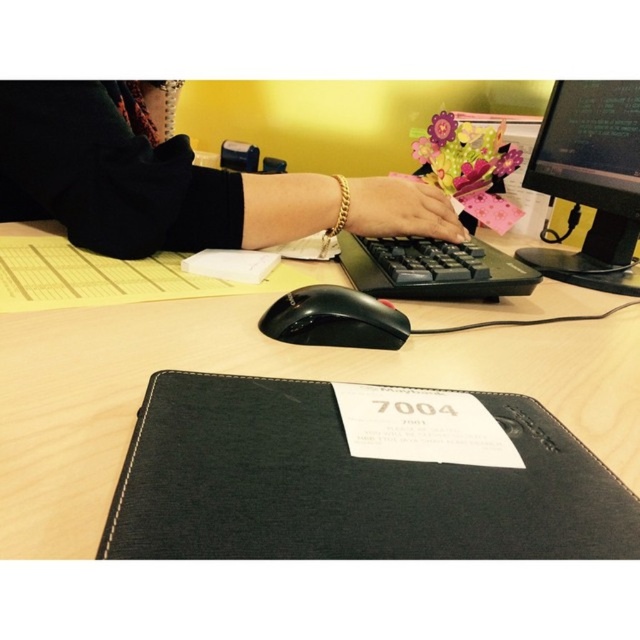
Is black leather jacket at center taller than black plastic keyboard at center?

Indeed, black leather jacket at center has a greater height compared to black plastic keyboard at center.

In the scene shown: Between black leather jacket at center and black plastic keyboard at center, which one is positioned lower?

black plastic keyboard at center is below.

Is point (68, 140) in front of point (451, 280)?

That is True.

You are a GUI agent. You are given a task and a screenshot of the screen. Output one action in this format:
    pyautogui.click(x=<x>, y=<y>)
    Task: Click on the black leather jacket at center
    
    Given the screenshot: What is the action you would take?
    pyautogui.click(x=176, y=180)

Is black leather jacket at center to the left of gold bracelet at center from the viewer's perspective?

Indeed, black leather jacket at center is positioned on the left side of gold bracelet at center.

Between point (372, 205) and point (456, 216), which one is positioned in front?

Positioned in front is point (372, 205).

Between point (104, 106) and point (349, 202), which one is positioned behind?

The point (349, 202) is behind.

This screenshot has width=640, height=640. In order to click on black leather jacket at center in this screenshot , I will do `click(176, 180)`.

Can you confirm if black plastic mouse at center is positioned to the left of gold bracelet at center?

Correct, you'll find black plastic mouse at center to the left of gold bracelet at center.

Find the location of a particular element. black plastic mouse at center is located at coordinates (333, 320).

At what (x,y) coordinates should I click in order to perform the action: click on black plastic mouse at center. Please return your answer as a coordinate pair (x, y). Image resolution: width=640 pixels, height=640 pixels. Looking at the image, I should click on (333, 320).